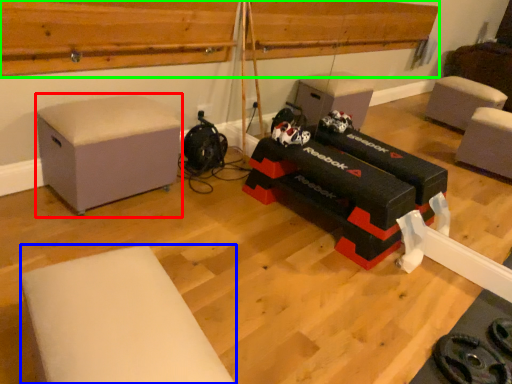
Question: Based on their relative distances, which object is nearer to furniture (highlighted by a red box)? Choose from furniture (highlighted by a blue box) and wood (highlighted by a green box).

Choices:
 (A) furniture
 (B) wood

Answer: (B)